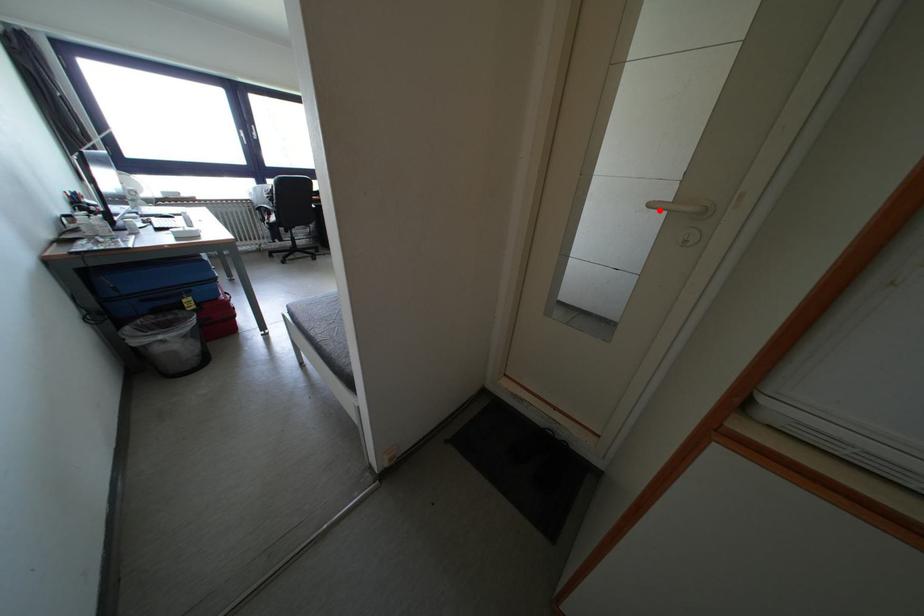
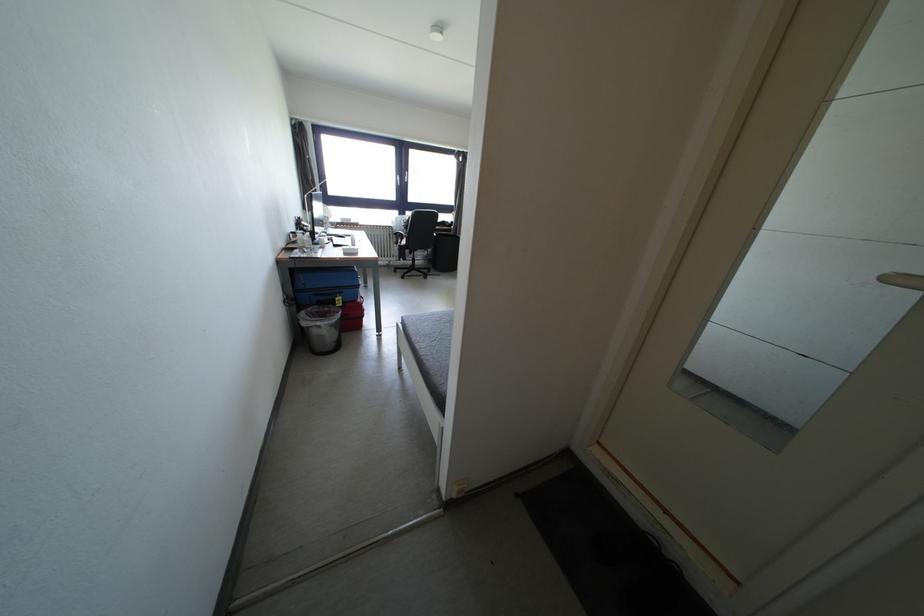
Question: I am providing you with two images of the same scene from different viewpoints. A red point is shown in image1. For the corresponding object point in image2, is it positioned nearer or farther from the camera?

Choices:
 (A) Nearer
 (B) Farther

Answer: (B)